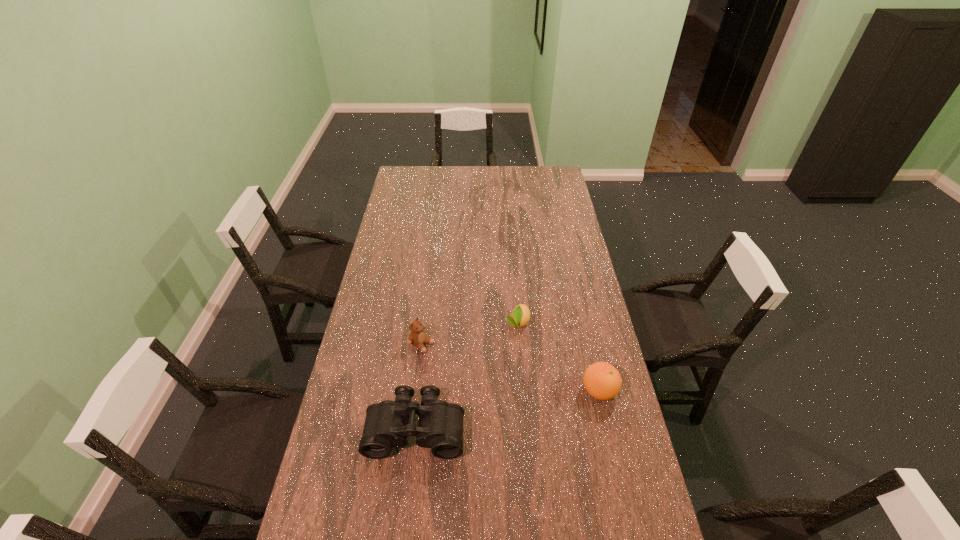
Where is `free space that satisfies the following two spatial constraints: 1. on the back side of the teddy bear; 2. on the right side of the shortest object`? The width and height of the screenshot is (960, 540). free space that satisfies the following two spatial constraints: 1. on the back side of the teddy bear; 2. on the right side of the shortest object is located at coordinates (424, 323).

At what (x,y) coordinates should I click in order to perform the action: click on vacant space that satisfies the following two spatial constraints: 1. on the front side of the orange; 2. on the left side of the teddy bear. Please return your answer as a coordinate pair (x, y). The image size is (960, 540). Looking at the image, I should click on [x=417, y=391].